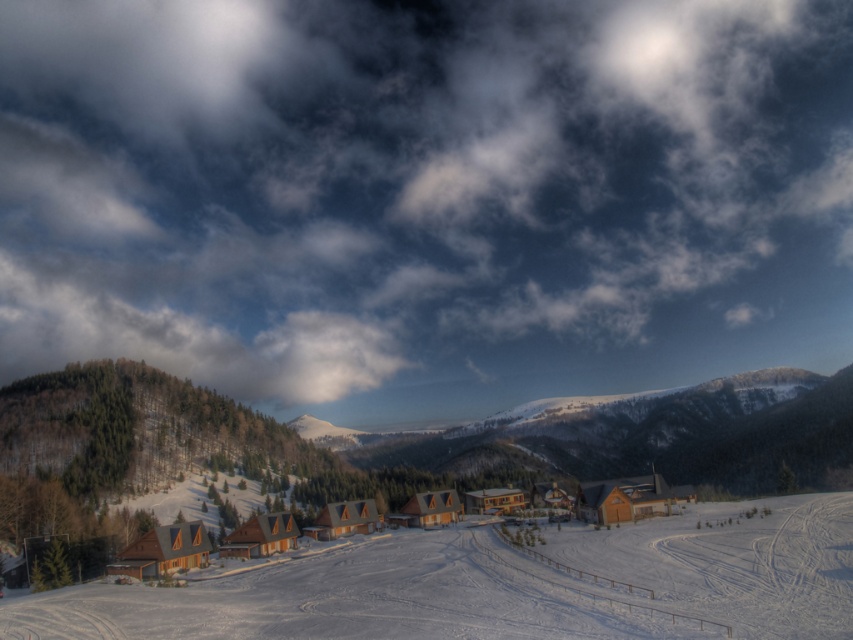
Is smooth snow ski slope at center to the left of wooden cabin at center from the viewer's perspective?

No, smooth snow ski slope at center is not to the left of wooden cabin at center.

Where is `smooth snow ski slope at center`? The height and width of the screenshot is (640, 853). smooth snow ski slope at center is located at coordinates (502, 584).

Measure the distance between cloudy sky at upper center and smooth snow ski slope at center.

The distance of cloudy sky at upper center from smooth snow ski slope at center is 572.36 meters.

Who is taller, cloudy sky at upper center or smooth snow ski slope at center?

cloudy sky at upper center is taller.

Which is in front, point (811, 188) or point (488, 557)?

Point (488, 557) is more forward.

The width and height of the screenshot is (853, 640). Identify the location of cloudy sky at upper center. (425, 193).

Who is positioned more to the right, cloudy sky at upper center or wooden cabin at center?

Positioned to the right is wooden cabin at center.

Measure the distance between point (384, 156) and camera.

Point (384, 156) is 2138.47 feet away from camera.

Find the location of a particular element. The height and width of the screenshot is (640, 853). cloudy sky at upper center is located at coordinates (425, 193).